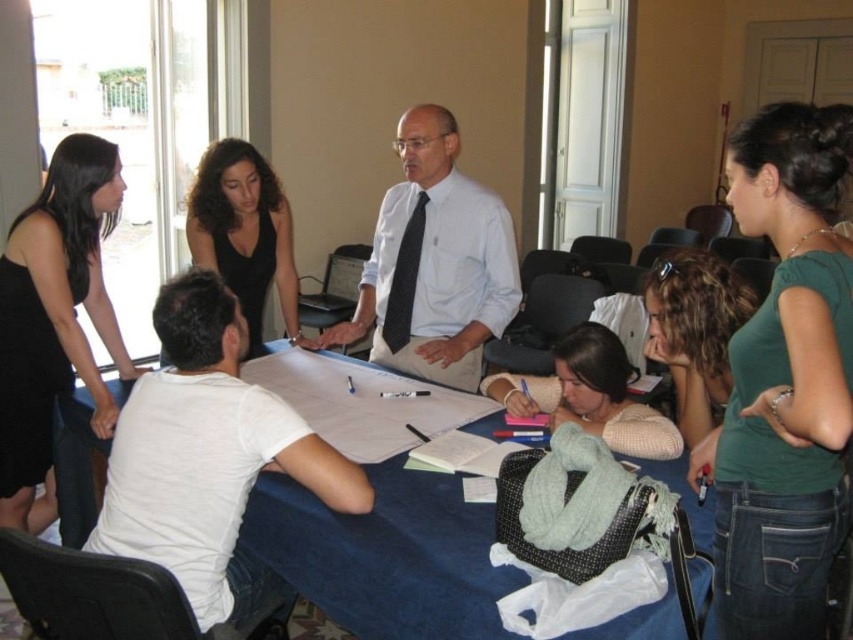
You are standing in the room and notice a point marked at coordinates (784, 381). What object or feature is located at that point?

The point at coordinates (784, 381) indicates the green matte shirt at upper right.

From the picture: You are a photographer trying to capture a group photo of the meeting participants. You want to ensure both the white shirt at center and the black dress at center are clearly visible in the frame. Which clothing item should you position closer to the light source coming from the left side of the frame to avoid shadows?

The black dress at center should be positioned closer to the light source coming from the left side of the frame because dark colors like black absorb more light and require better illumination to appear visible in photos, whereas lighter colors like white reflect more light naturally.

You are standing at the point labeled point (x=247, y=326) in the scene. If you turn around to face the opposite direction, will you be facing towards or away from the point labeled point (x=483, y=237)?

Since point (x=483, y=237) is behind point (x=247, y=326), turning around to face the opposite direction would mean facing towards point (x=483, y=237).